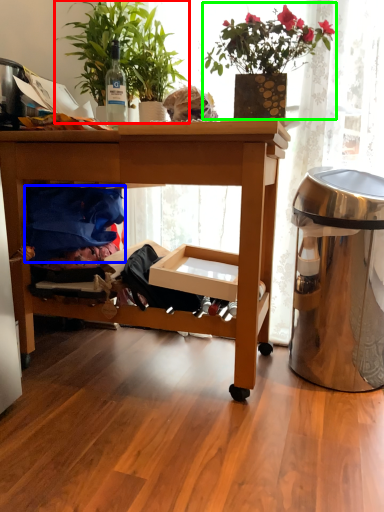
Question: Estimate the real-world distances between objects in this image. Which object is closer to houseplant (highlighted by a red box), clothing (highlighted by a blue box) or houseplant (highlighted by a green box)?

Choices:
 (A) clothing
 (B) houseplant

Answer: (B)